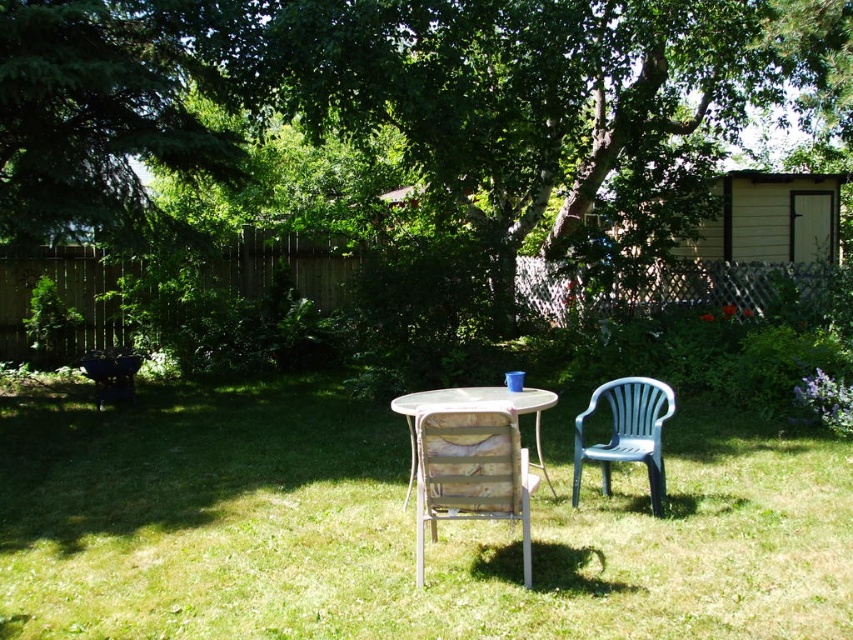
Question: Considering the real-world distances, which object is closest to the green leafy tree at center?

Choices:
 (A) blue plastic chair at right
 (B) green grass at center
 (C) wooden slatted chair at center

Answer: (A)

Question: Which of these objects is positioned farthest from the green grass at center?

Choices:
 (A) green leafy tree at center
 (B) wooden table at center
 (C) wooden slatted chair at center
 (D) blue plastic chair at right

Answer: (A)

Question: Is green leafy tree at center thinner than blue plastic chair at right?

Choices:
 (A) no
 (B) yes

Answer: (A)

Question: Considering the real-world distances, which object is farthest from the green leafy tree at center?

Choices:
 (A) green grass at center
 (B) wooden slatted chair at center

Answer: (A)

Question: Does green leafy tree at center have a larger size compared to wooden table at center?

Choices:
 (A) yes
 (B) no

Answer: (A)

Question: Can you confirm if green grass at center is positioned above blue plastic chair at right?

Choices:
 (A) yes
 (B) no

Answer: (B)